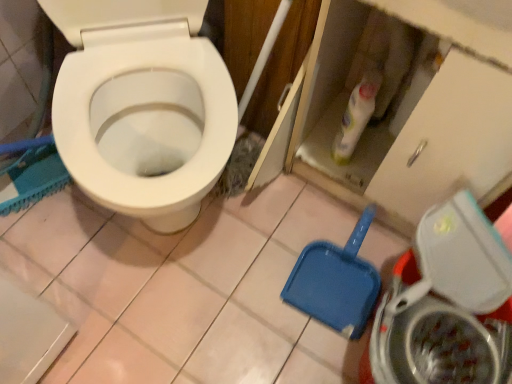
Find the location of a particular element. This screenshot has height=384, width=512. free location in front of blue plastic shovel at lower right is located at coordinates (300, 348).